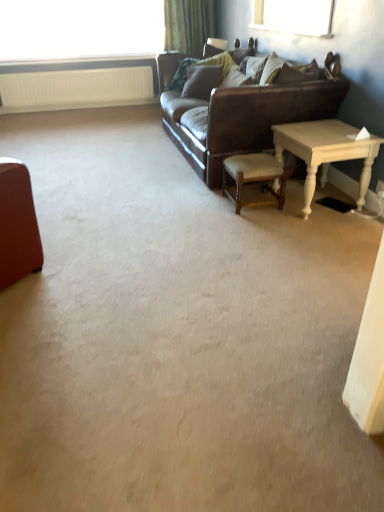
Question: Considering the relative sizes of white textured radiator at upper left and wooden chair at center in the image provided, is white textured radiator at upper left smaller than wooden chair at center?

Choices:
 (A) yes
 (B) no

Answer: (B)

Question: Is white textured radiator at upper left facing away from wooden chair at center?

Choices:
 (A) yes
 (B) no

Answer: (B)

Question: Considering the relative positions of white textured radiator at upper left and wooden chair at center in the image provided, is white textured radiator at upper left to the left of wooden chair at center from the viewer's perspective?

Choices:
 (A) yes
 (B) no

Answer: (A)

Question: Does white textured radiator at upper left have a greater width compared to wooden chair at center?

Choices:
 (A) no
 (B) yes

Answer: (A)

Question: From a real-world perspective, does white textured radiator at upper left sit lower than wooden chair at center?

Choices:
 (A) yes
 (B) no

Answer: (B)

Question: Which is correct: leather couch at center is inside transparent glass window at upper left, or outside of it?

Choices:
 (A) outside
 (B) inside

Answer: (A)

Question: From a real-world perspective, is leather couch at center positioned above or below transparent glass window at upper left?

Choices:
 (A) below
 (B) above

Answer: (A)

Question: In terms of height, does leather couch at center look taller or shorter compared to transparent glass window at upper left?

Choices:
 (A) tall
 (B) short

Answer: (A)

Question: From the image's perspective, is leather couch at center located above or below transparent glass window at upper left?

Choices:
 (A) above
 (B) below

Answer: (B)

Question: Would you say wooden chair at center is inside or outside leather couch at center?

Choices:
 (A) inside
 (B) outside

Answer: (B)

Question: In terms of height, does wooden chair at center look taller or shorter compared to leather couch at center?

Choices:
 (A) tall
 (B) short

Answer: (B)

Question: Relative to leather couch at center, is wooden chair at center in front or behind?

Choices:
 (A) front
 (B) behind

Answer: (B)

Question: In terms of width, does wooden chair at center look wider or thinner when compared to leather couch at center?

Choices:
 (A) wide
 (B) thin

Answer: (B)

Question: Is wooden chair at center in front of or behind green fabric curtain at upper center in the image?

Choices:
 (A) behind
 (B) front

Answer: (B)

Question: Is wooden chair at center wider or thinner than green fabric curtain at upper center?

Choices:
 (A) thin
 (B) wide

Answer: (B)